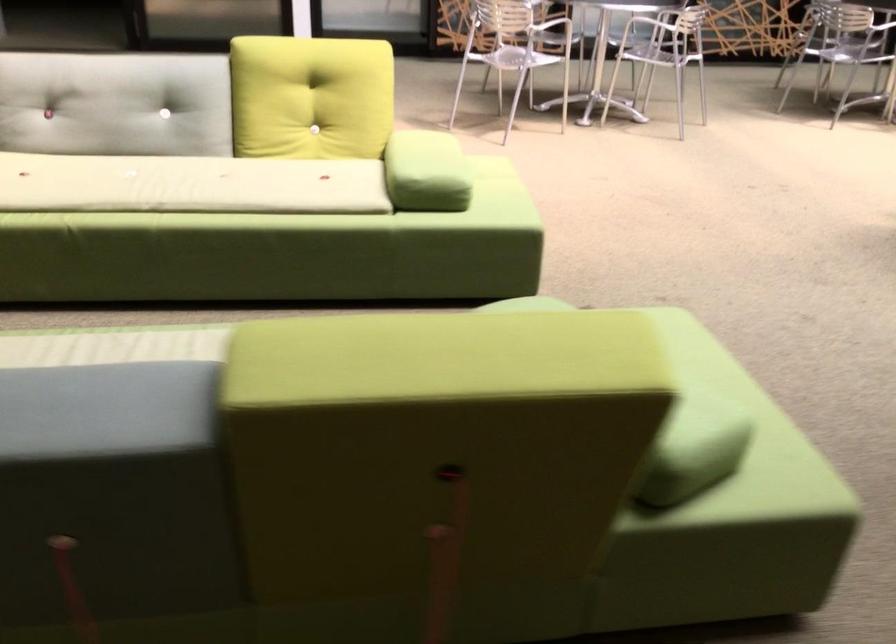
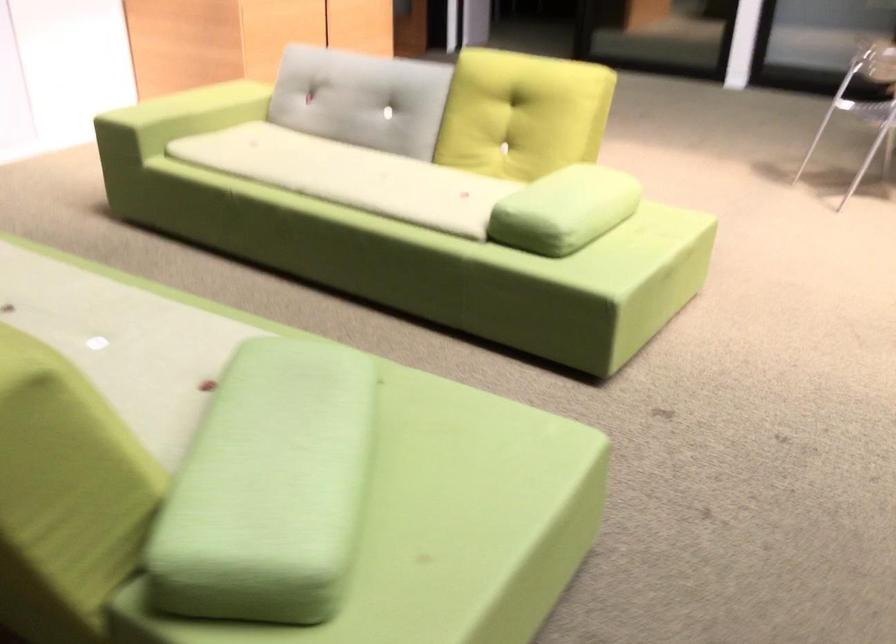
The point at [657,426] is marked in the first image. Where is the corresponding point in the second image?

(64, 497)